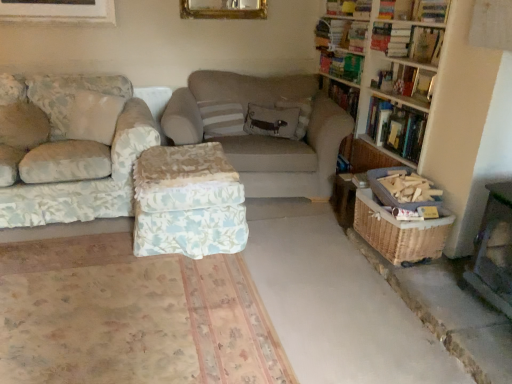
Question: Can you confirm if floral fabric couch at left, the second studio couch when ordered from right to left, is positioned to the right of wooden bookshelf at upper right?

Choices:
 (A) yes
 (B) no

Answer: (B)

Question: Is floral fabric couch at left, arranged as the 1th studio couch when viewed from the left, wider than wooden bookshelf at upper right?

Choices:
 (A) no
 (B) yes

Answer: (B)

Question: Does floral fabric couch at left, arranged as the 1th studio couch when viewed from the left, have a larger size compared to wooden bookshelf at upper right?

Choices:
 (A) yes
 (B) no

Answer: (A)

Question: Does floral fabric couch at left, the second studio couch when ordered from right to left, have a greater height compared to wooden bookshelf at upper right?

Choices:
 (A) no
 (B) yes

Answer: (B)

Question: Would you say floral fabric couch at left, the second studio couch when ordered from right to left, contains wooden bookshelf at upper right?

Choices:
 (A) no
 (B) yes

Answer: (A)

Question: From the image's perspective, is floral fabric couch at left, the second studio couch when ordered from right to left, on top of wooden bookshelf at upper right?

Choices:
 (A) yes
 (B) no

Answer: (B)

Question: Is hardcover book at upper right, arranged as the 5th book when ordered from the bottom, not within beige fabric studio couch at center, placed as the 1th studio couch when sorted from right to left?

Choices:
 (A) yes
 (B) no

Answer: (A)

Question: Can you confirm if hardcover book at upper right, arranged as the 5th book when ordered from the bottom, is positioned to the left of beige fabric studio couch at center, acting as the 2th studio couch starting from the left?

Choices:
 (A) no
 (B) yes

Answer: (A)

Question: Does hardcover book at upper right, arranged as the 5th book when ordered from the bottom, touch beige fabric studio couch at center, placed as the 1th studio couch when sorted from right to left?

Choices:
 (A) yes
 (B) no

Answer: (B)

Question: Does hardcover book at upper right, which appears as the 1th book when viewed from the top, have a greater width compared to beige fabric studio couch at center, acting as the 2th studio couch starting from the left?

Choices:
 (A) yes
 (B) no

Answer: (B)

Question: From a real-world perspective, does hardcover book at upper right, which appears as the 1th book when viewed from the top, stand above beige fabric studio couch at center, acting as the 2th studio couch starting from the left?

Choices:
 (A) yes
 (B) no

Answer: (A)

Question: Is the position of hardcover book at upper right, which appears as the 1th book when viewed from the top, more distant than that of beige fabric studio couch at center, placed as the 1th studio couch when sorted from right to left?

Choices:
 (A) no
 (B) yes

Answer: (B)

Question: From a real-world perspective, is hardcover book at upper right, arranged as the 5th book when ordered from the bottom, physically below wooden bookshelf at right?

Choices:
 (A) no
 (B) yes

Answer: (A)